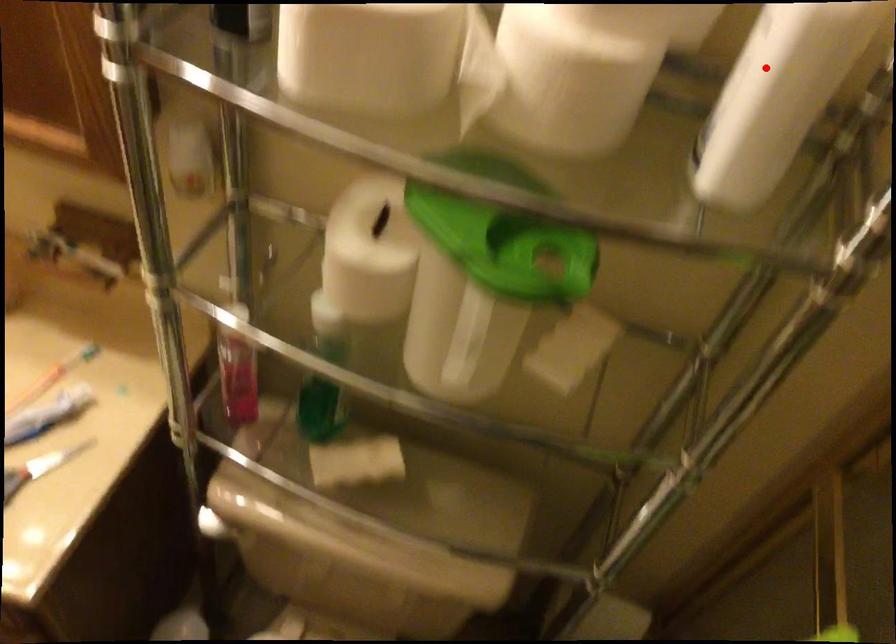
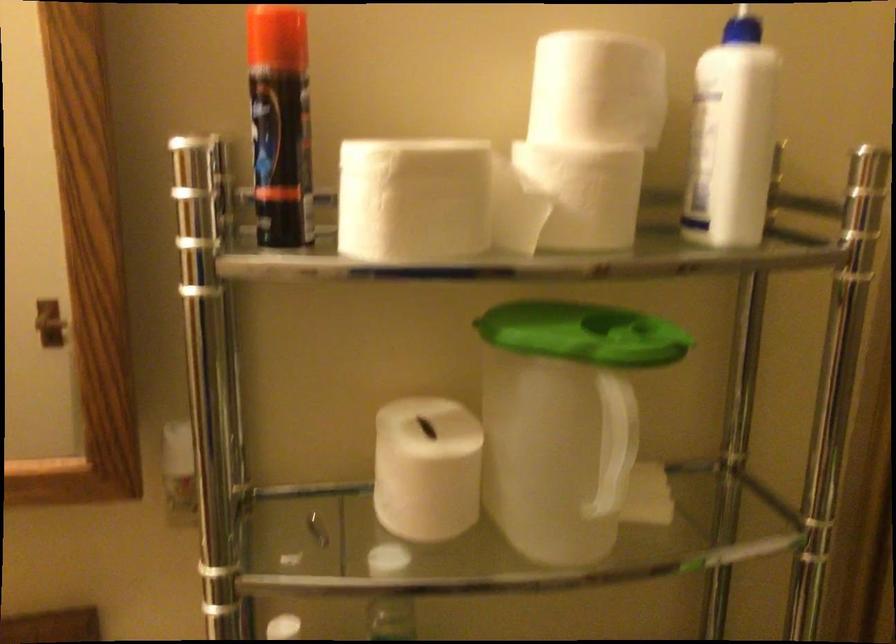
In the second image, find the point that corresponds to the highlighted location in the first image.

(731, 137)